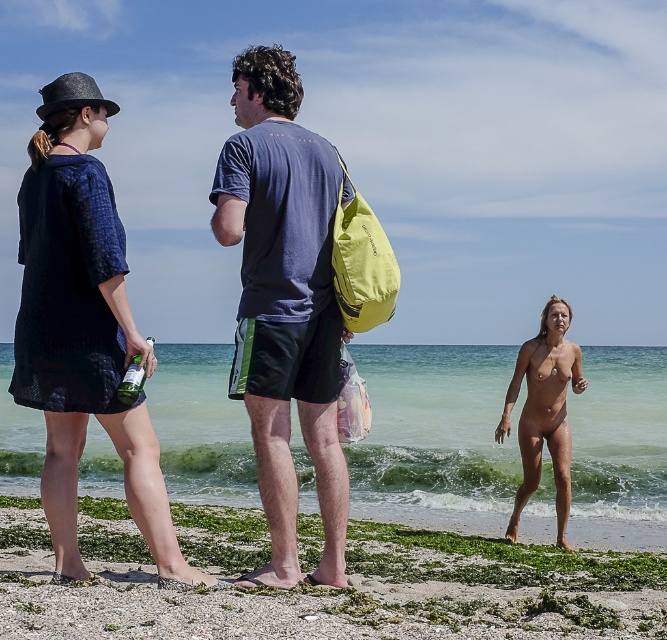
Is clear water at lower right positioned in front of smooth skin body at lower right?

No, it is not.

From the picture: Is clear water at lower right below smooth skin body at lower right?

Indeed, clear water at lower right is positioned under smooth skin body at lower right.

I want to click on clear water at lower right, so click(436, 428).

Between clear water at lower right and blue textured dress at left, which one has more height?

clear water at lower right is taller.

Is clear water at lower right shorter than blue textured dress at left?

No.

Find the location of `clear water at lower right`. clear water at lower right is located at coordinates (436, 428).

Can you confirm if smooth sand at lower center is shorter than green glass bottle at lower left?

Correct, smooth sand at lower center is not as tall as green glass bottle at lower left.

Image resolution: width=667 pixels, height=640 pixels. Describe the element at coordinates (329, 588) in the screenshot. I see `smooth sand at lower center` at that location.

You are a GUI agent. You are given a task and a screenshot of the screen. Output one action in this format:
    pyautogui.click(x=<x>, y=<y>)
    Task: Click on the smooth sand at lower center
    This screenshot has width=667, height=640.
    Given the screenshot: What is the action you would take?
    pyautogui.click(x=329, y=588)